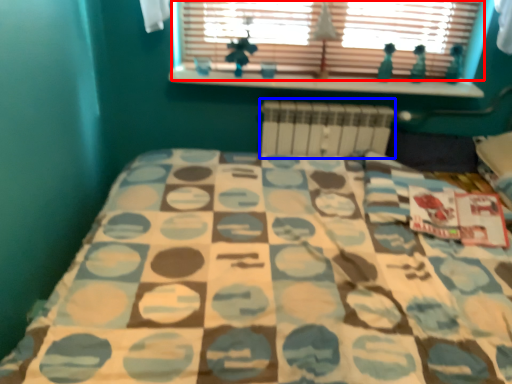
Question: Among these objects, which one is nearest to the camera, window (highlighted by a red box) or radiator (highlighted by a blue box)?

Choices:
 (A) window
 (B) radiator

Answer: (A)